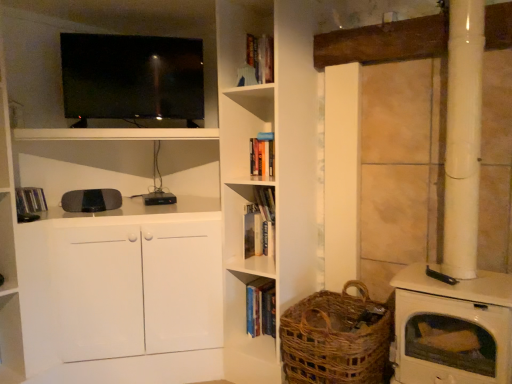
Question: From the image's perspective, is hardcover book at left, positioned as the first book in top-to-bottom order, above or below hardcover book at center, which is the 2th book from top to bottom?

Choices:
 (A) above
 (B) below

Answer: (A)

Question: Considering their positions, is hardcover book at left, the 3th book from the bottom, located in front of or behind hardcover book at center, which ranks as the second book in left-to-right order?

Choices:
 (A) behind
 (B) front

Answer: (B)

Question: Which object is positioned farthest from the hardcover book at left, the 3th book from the bottom?

Choices:
 (A) matte black tv at upper left
 (B) woven brown basket at lower right
 (C) hardcover book at center, the second book in the bottom-to-top sequence
 (D) hardcover book at center, the third book positioned from the top

Answer: (B)

Question: Which object is positioned farthest from the matte black tv at upper left?

Choices:
 (A) hardcover book at center, marked as the 1th book in a right-to-left arrangement
 (B) woven brown basket at lower right
 (C) hardcover book at left, which is the 3th book in right-to-left order
 (D) hardcover book at center, which is the 2th book from top to bottom

Answer: (B)